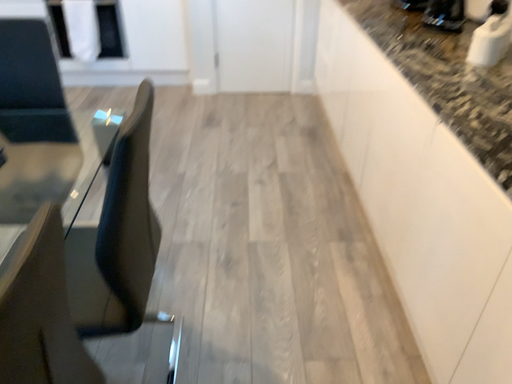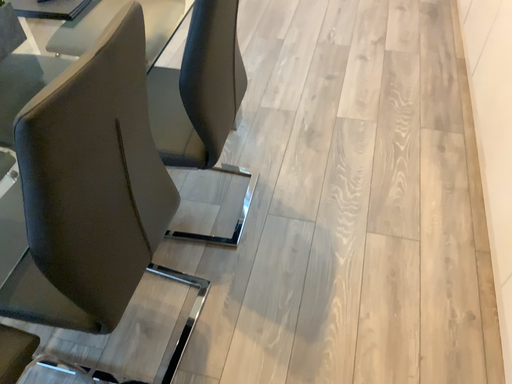
Question: Which way did the camera rotate in the video?

Choices:
 (A) rotated left
 (B) rotated right

Answer: (A)